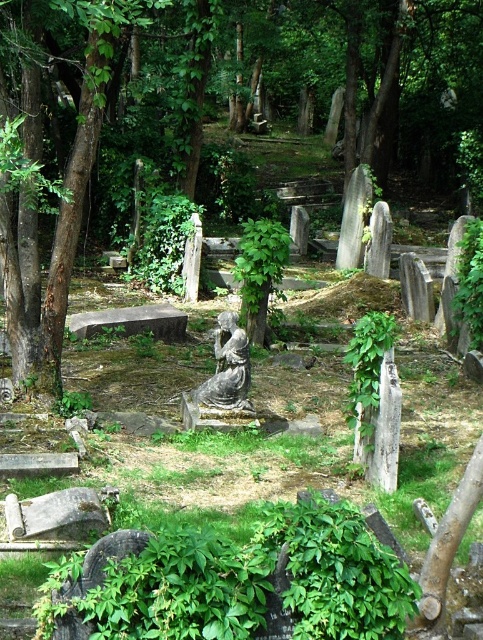
Question: Does brown wood tree at center have a larger size compared to gray stone statue at center?

Choices:
 (A) no
 (B) yes

Answer: (B)

Question: Which point is closer to the camera?

Choices:
 (A) brown wood tree at center
 (B) gray stone statue at center

Answer: (A)

Question: Is brown wood tree at center closer to the viewer compared to gray stone statue at center?

Choices:
 (A) yes
 (B) no

Answer: (A)

Question: Which point is closer to the camera?

Choices:
 (A) brown wood tree at center
 (B) gray stone statue at center

Answer: (A)

Question: Does brown wood tree at center have a larger size compared to gray stone statue at center?

Choices:
 (A) no
 (B) yes

Answer: (B)